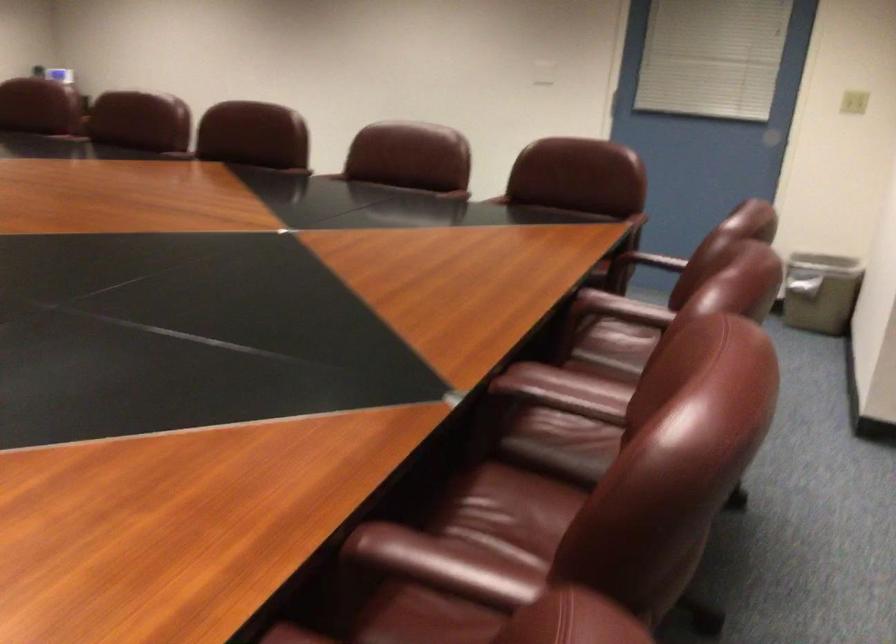
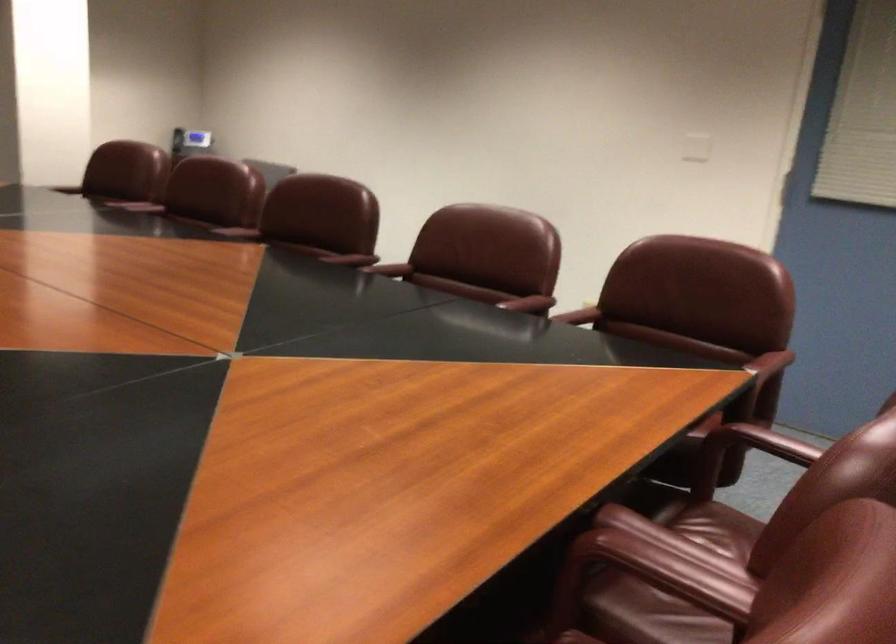
The point at (650, 259) is marked in the first image. Where is the corresponding point in the second image?

(761, 442)